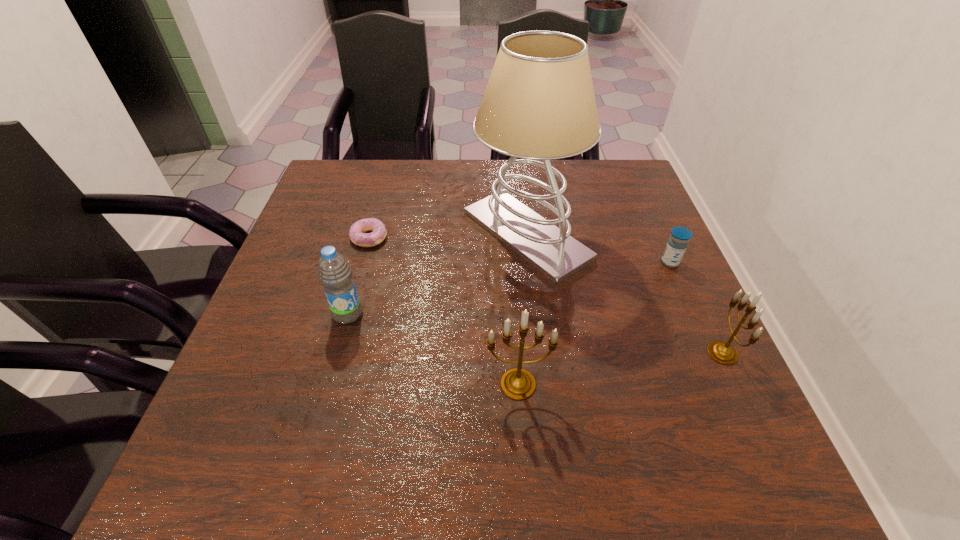
In the image, there is a desktop. In order to click on vacant region at the left edge in this screenshot , I will do `click(322, 305)`.

In the image, there is a desktop. At what (x,y) coordinates should I click in order to perform the action: click on free space at the right edge. Please return your answer as a coordinate pair (x, y). Image resolution: width=960 pixels, height=540 pixels. Looking at the image, I should click on (637, 285).

Where is `vacant space in between the fifth tallest object and the tallest object`? The width and height of the screenshot is (960, 540). vacant space in between the fifth tallest object and the tallest object is located at coordinates (598, 248).

Where is `free spot between the shorter candelabrum and the left candelabrum`? free spot between the shorter candelabrum and the left candelabrum is located at coordinates (620, 368).

Identify the location of vacant point located between the shorter candelabrum and the doughnut. The image size is (960, 540). (546, 295).

At what (x,y) coordinates should I click in order to perform the action: click on vacant area that lies between the medicine and the third nearest object. Please return your answer as a coordinate pair (x, y). Looking at the image, I should click on (509, 288).

Find the location of a particular element. The width and height of the screenshot is (960, 540). unoccupied position between the water bottle and the fifth tallest object is located at coordinates (509, 288).

Where is `free space that is in between the left candelabrum and the water bottle`? This screenshot has width=960, height=540. free space that is in between the left candelabrum and the water bottle is located at coordinates (433, 349).

Identify which object is the fifth closest to the medicine. Please provide its 2D coordinates. Your answer should be formatted as a tuple, i.e. [(x, y)], where the tuple contains the x and y coordinates of a point satisfying the conditions above.

[(334, 272)]

Where is `the closest object to the water bottle`? The height and width of the screenshot is (540, 960). the closest object to the water bottle is located at coordinates (357, 231).